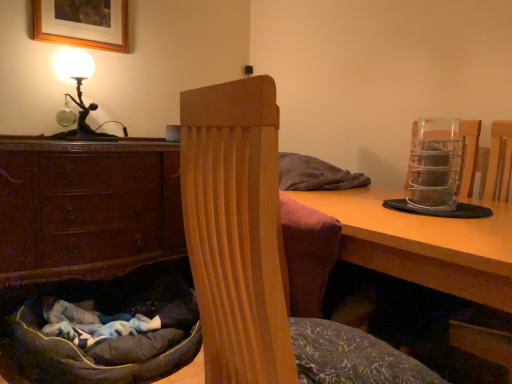
Question: Is metallic wire mesh at right bigger or smaller than wooden table at center?

Choices:
 (A) small
 (B) big

Answer: (A)

Question: From the image's perspective, is metallic wire mesh at right above or below wooden table at center?

Choices:
 (A) above
 (B) below

Answer: (A)

Question: Estimate the real-world distances between objects in this image. Which object is closer to the metallic wire mesh at right?

Choices:
 (A) brown wood chest of drawers at lower left
 (B) dark gray plush bean bag chair at lower left, which ranks as the first bean bag chair in back-to-front order
 (C) wooden picture frame at upper left
 (D) velvet-like brown bean bag chair at center, which ranks as the 2th bean bag chair in left-to-right order
 (E) bronze/golden table lamp at upper left

Answer: (D)

Question: Which is nearer to the wooden table at center?

Choices:
 (A) brown wood chest of drawers at lower left
 (B) velvet-like brown bean bag chair at center, which ranks as the second bean bag chair in back-to-front order
 (C) wooden picture frame at upper left
 (D) metallic wire mesh at right
 (E) dark gray plush bean bag chair at lower left, which ranks as the first bean bag chair in back-to-front order

Answer: (B)